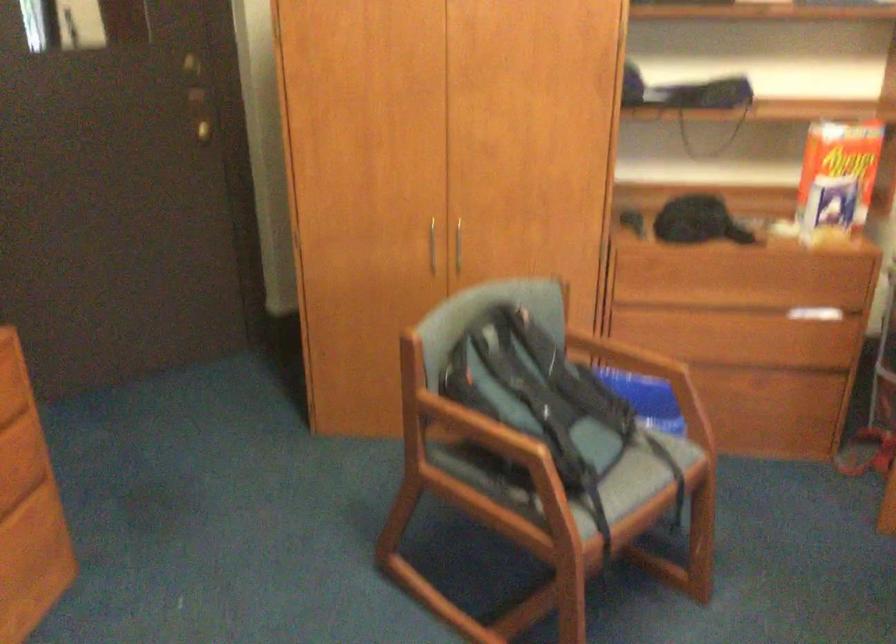
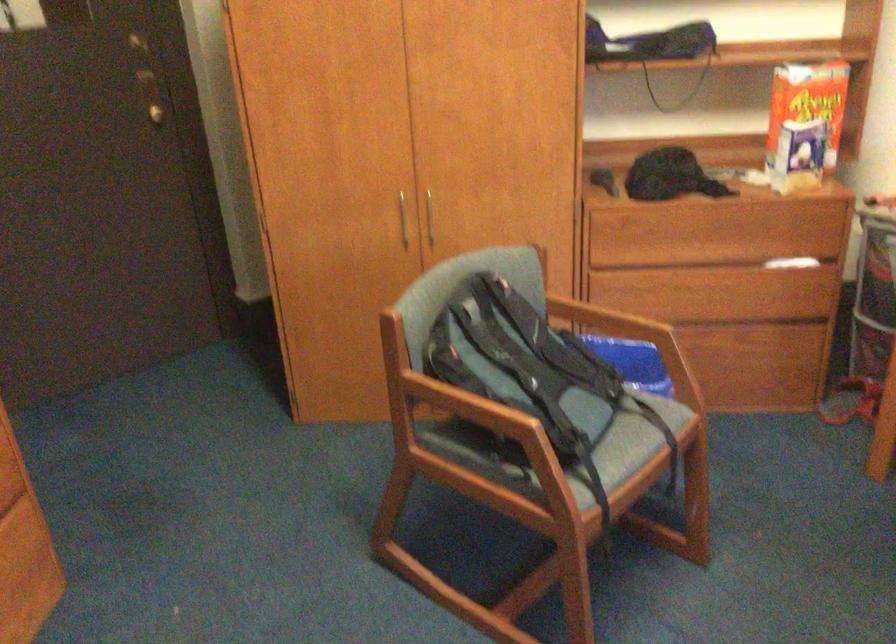
Locate, in the second image, the point that corresponds to point 536,393 in the first image.

(522, 364)